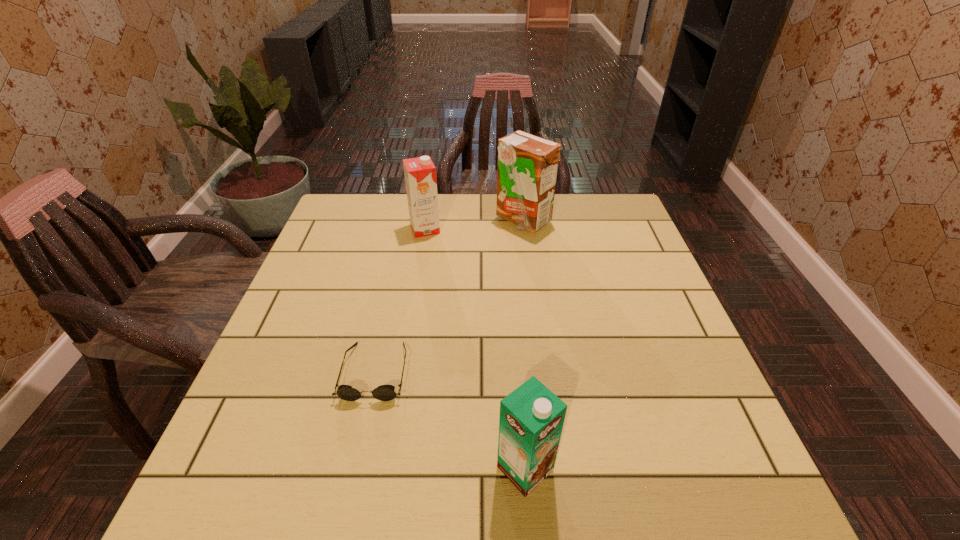
Find the location of a particular element. free space at the left edge of the desktop is located at coordinates (340, 332).

Where is `vacant area at the right edge of the desktop`? vacant area at the right edge of the desktop is located at coordinates (624, 298).

The image size is (960, 540). Find the location of `vacant space at the near left corner of the desktop`. vacant space at the near left corner of the desktop is located at coordinates (227, 517).

Find the location of a particular element. The image size is (960, 540). free space at the far right corner of the desktop is located at coordinates (618, 234).

Image resolution: width=960 pixels, height=540 pixels. In order to click on free space between the nearest carton and the leftmost carton in this screenshot , I will do `click(475, 349)`.

In order to click on vacant area that lies between the nearest carton and the sunglasses in this screenshot , I will do `click(450, 420)`.

This screenshot has width=960, height=540. Find the location of `vacant area between the second nearest object and the nearest carton`. vacant area between the second nearest object and the nearest carton is located at coordinates (450, 420).

Locate an element on the screen. This screenshot has height=540, width=960. vacant space that's between the leftmost carton and the nearest object is located at coordinates (475, 349).

I want to click on object that stands as the third closest to the shortest object, so click(x=527, y=164).

Identify which object is the nearest to the leftmost carton. Please provide its 2D coordinates. Your answer should be formatted as a tuple, i.e. [(x, y)], where the tuple contains the x and y coordinates of a point satisfying the conditions above.

[(527, 164)]